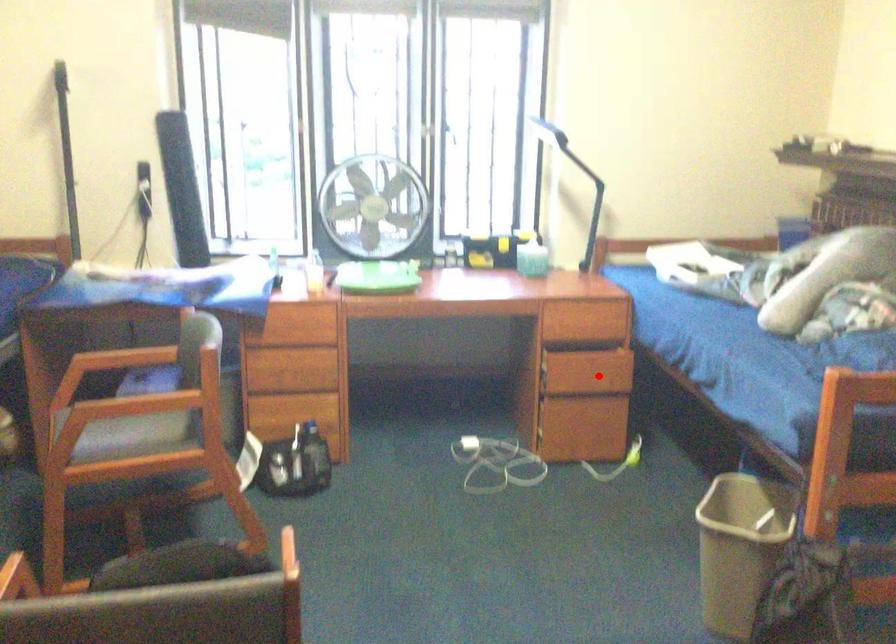
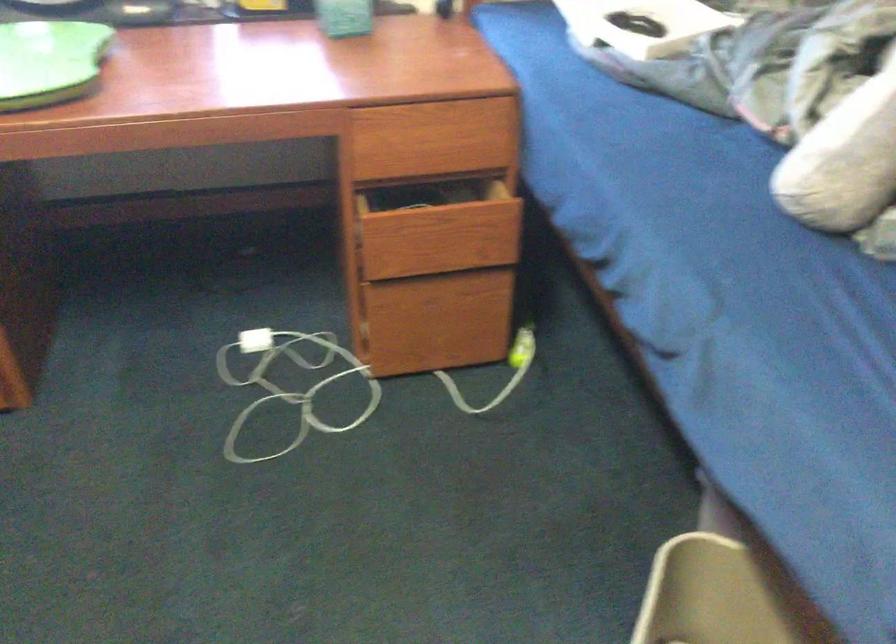
The point at the highlighted location is marked in the first image. Where is the corresponding point in the second image?

(458, 242)